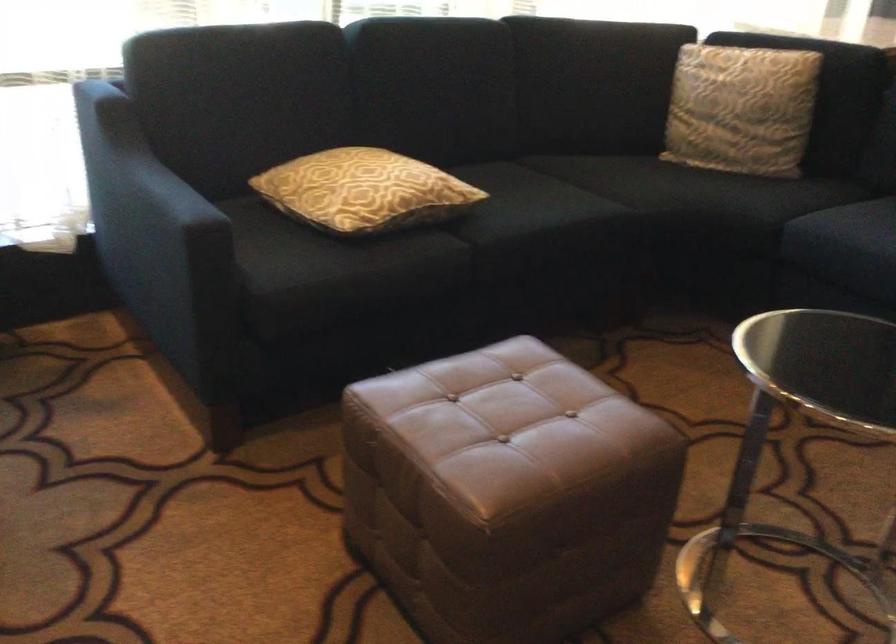
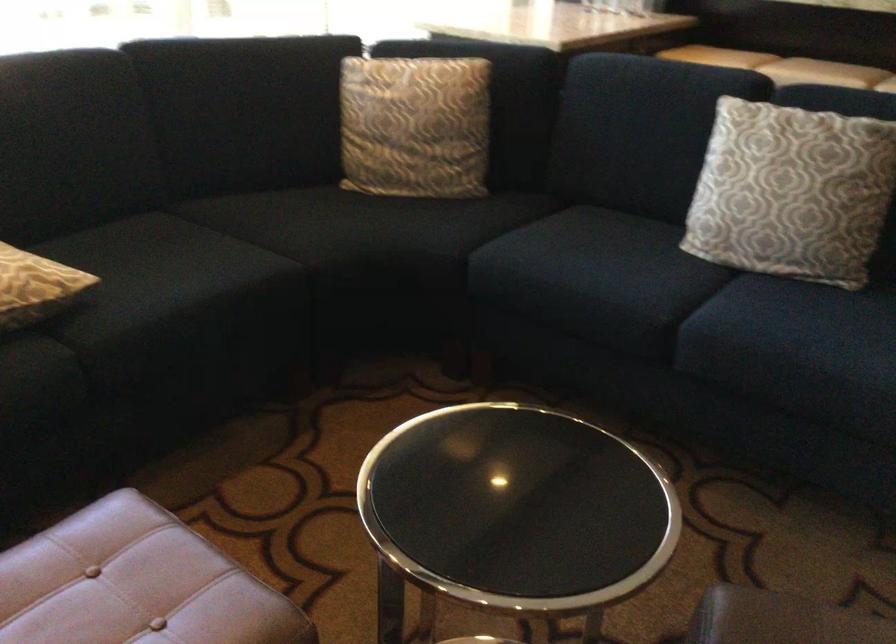
Question: The camera is either moving clockwise (left) or counter-clockwise (right) around the object. The first image is from the beginning of the video and the second image is from the end. Is the camera moving left or right when shooting the video?

Choices:
 (A) Left
 (B) Right

Answer: (A)